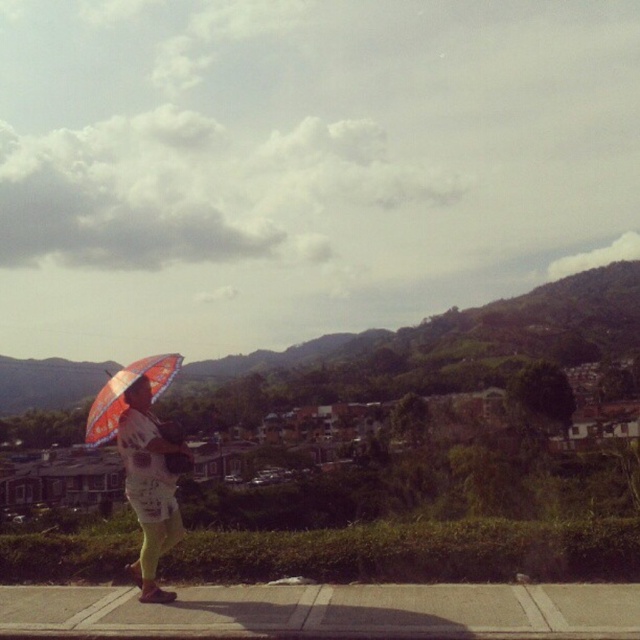
Between point (145, 596) and point (150, 380), which one is positioned in front?

Positioned in front is point (145, 596).

Does matte orange umbrella at left appear over orange fabric umbrella at left?

No.

At what (x,y) coordinates should I click in order to perform the action: click on matte orange umbrella at left. Please return your answer as a coordinate pair (x, y). This screenshot has height=640, width=640. Looking at the image, I should click on (x=148, y=484).

Identify the location of matte orange umbrella at left. This screenshot has width=640, height=640. (148, 484).

Is point (467, 376) positioned behind point (157, 381)?

Yes, point (467, 376) is farther from viewer.

Can you confirm if green grassy hillside at upper center is shorter than orange fabric umbrella at left?

No.

Does point (460, 337) come farther from viewer compared to point (129, 378)?

Yes, it is.

Find the location of a particular element. This screenshot has height=640, width=640. green grassy hillside at upper center is located at coordinates (472, 328).

Which of these two, green grassy hillside at upper center or matte orange umbrella at left, stands shorter?

matte orange umbrella at left

Who is positioned more to the left, green grassy hillside at upper center or matte orange umbrella at left?

From the viewer's perspective, green grassy hillside at upper center appears more on the left side.

Locate an element on the screen. Image resolution: width=640 pixels, height=640 pixels. green grassy hillside at upper center is located at coordinates 472,328.